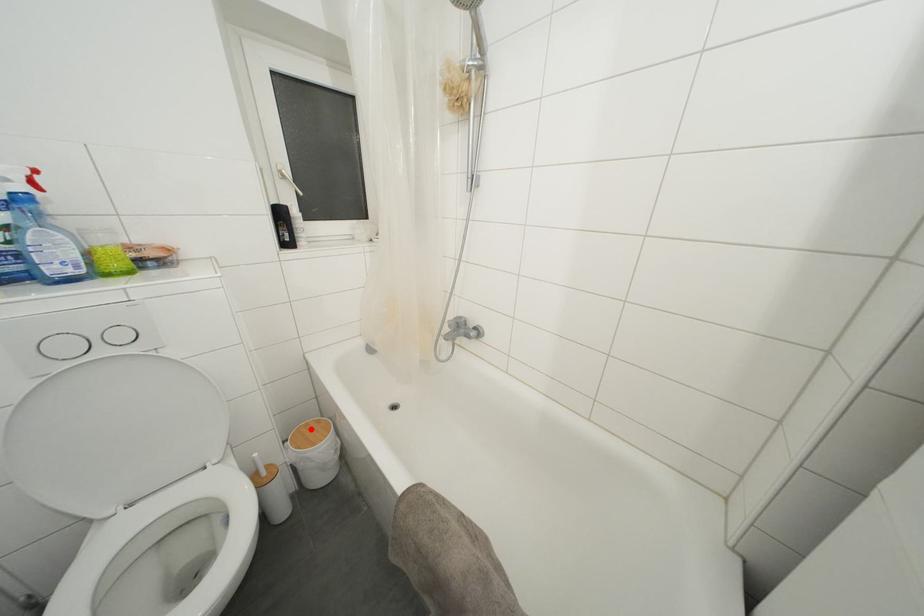
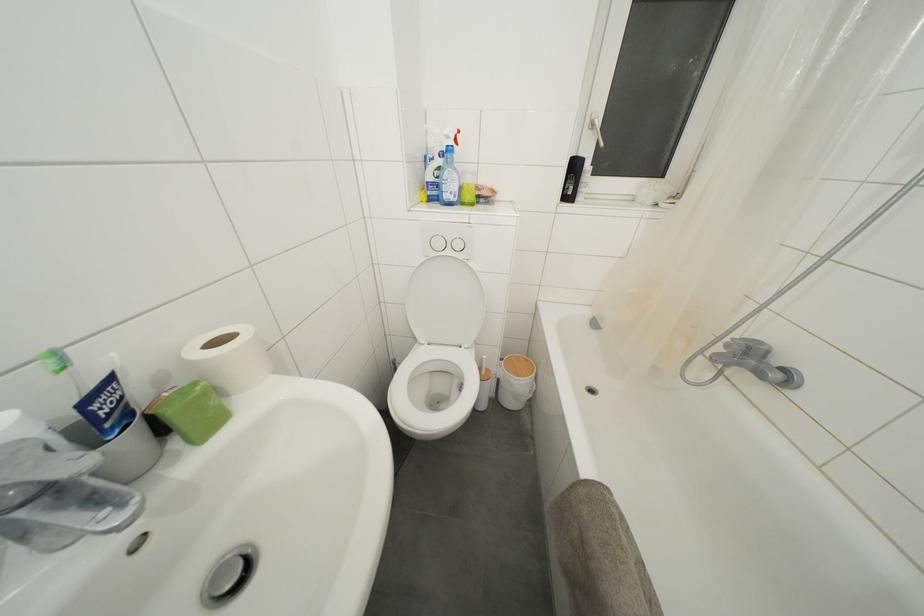
The point at the highlighted location is marked in the first image. Where is the corresponding point in the second image?

(521, 362)